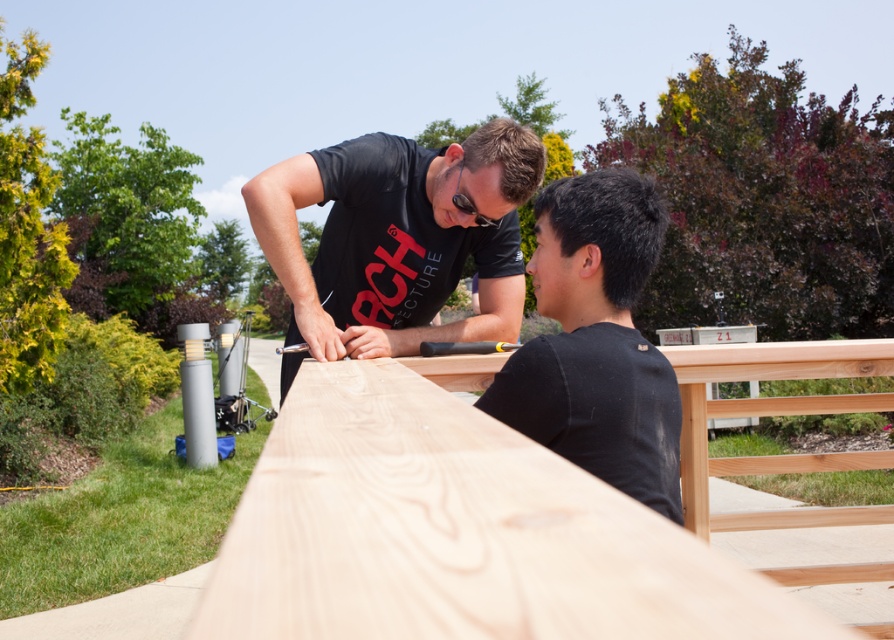
Is natural light wood at center smaller than matte black shirt at upper center?

Yes.

Can you confirm if natural light wood at center is positioned to the right of matte black shirt at upper center?

Indeed, natural light wood at center is positioned on the right side of matte black shirt at upper center.

Who is more distant from viewer, (359,371) or (339,161)?

The point (339,161) is more distant.

Where is `natural light wood at center`? Image resolution: width=894 pixels, height=640 pixels. natural light wood at center is located at coordinates (457, 532).

Between natural light wood at center and black matte shirt at upper right, which one appears on the left side from the viewer's perspective?

natural light wood at center

This screenshot has height=640, width=894. Describe the element at coordinates (457, 532) in the screenshot. I see `natural light wood at center` at that location.

Is point (436, 544) in front of point (546, 372)?

Yes.

Where is `natural light wood at center`? natural light wood at center is located at coordinates (457, 532).

Between matte black shirt at upper center and black matte shirt at upper right, which one has more height?

Standing taller between the two is matte black shirt at upper center.

Does point (370, 250) come behind point (613, 410)?

Yes, it is.

The height and width of the screenshot is (640, 894). What are the coordinates of `matte black shirt at upper center` in the screenshot? It's located at (398, 237).